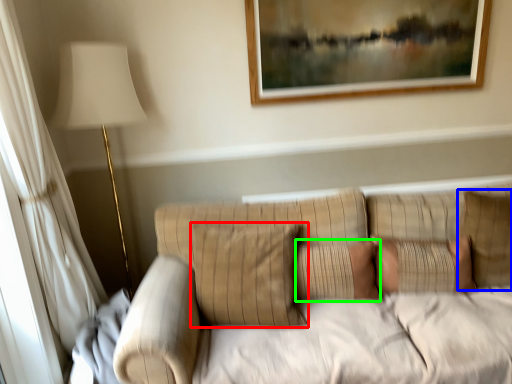
Question: Which is nearer to the pillow (highlighted by a red box)? pillow (highlighted by a blue box) or pillow (highlighted by a green box).

Choices:
 (A) pillow
 (B) pillow

Answer: (B)